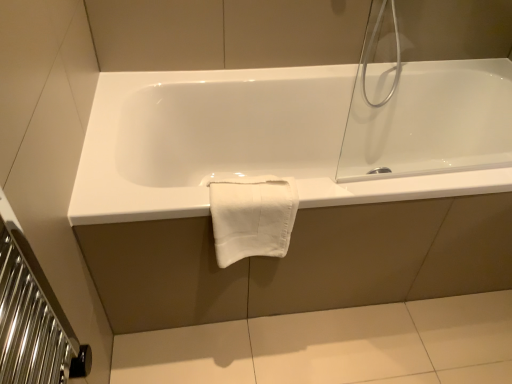
Question: From the image's perspective, is white glossy bathtub at center positioned above or below white cotton towel at center?

Choices:
 (A) above
 (B) below

Answer: (A)

Question: From a real-world perspective, is white glossy bathtub at center positioned above or below white cotton towel at center?

Choices:
 (A) below
 (B) above

Answer: (A)

Question: Based on their positions, is white glossy bathtub at center located to the left or right of white cotton towel at center?

Choices:
 (A) left
 (B) right

Answer: (B)

Question: Considering the positions of white cotton towel at center and white glossy bathtub at center in the image, is white cotton towel at center taller or shorter than white glossy bathtub at center?

Choices:
 (A) short
 (B) tall

Answer: (A)

Question: In the image, is white cotton towel at center positioned in front of or behind white glossy bathtub at center?

Choices:
 (A) front
 (B) behind

Answer: (A)

Question: Looking at the image, does white cotton towel at center seem bigger or smaller compared to white glossy bathtub at center?

Choices:
 (A) small
 (B) big

Answer: (A)

Question: From a real-world perspective, relative to white glossy bathtub at center, is white cotton towel at center vertically above or below?

Choices:
 (A) below
 (B) above

Answer: (B)